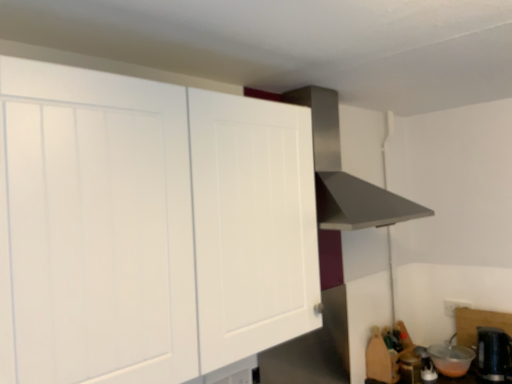
Locate an element on the screen. Image resolution: width=512 pixels, height=384 pixels. empty space that is ontop of stainless steel vent at upper center is located at coordinates (356, 82).